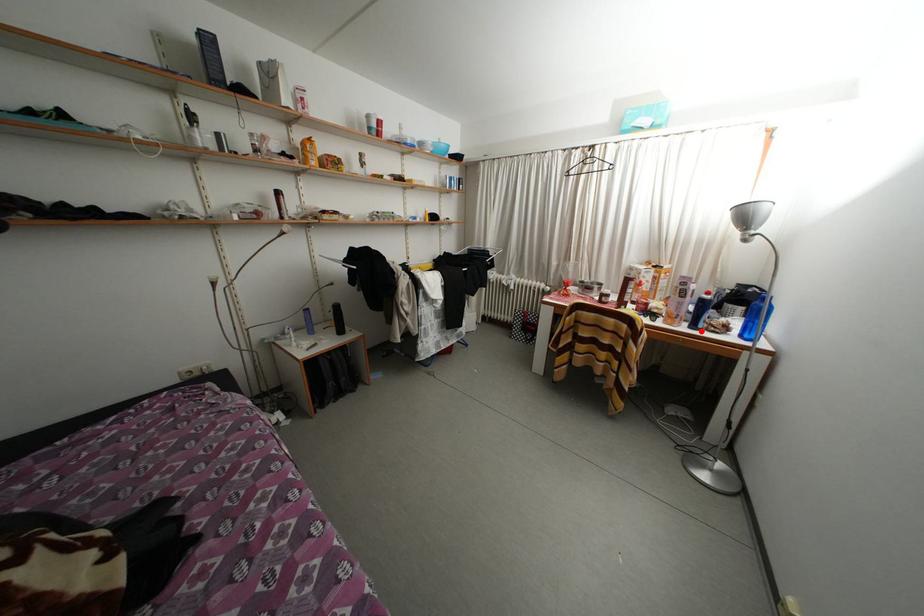
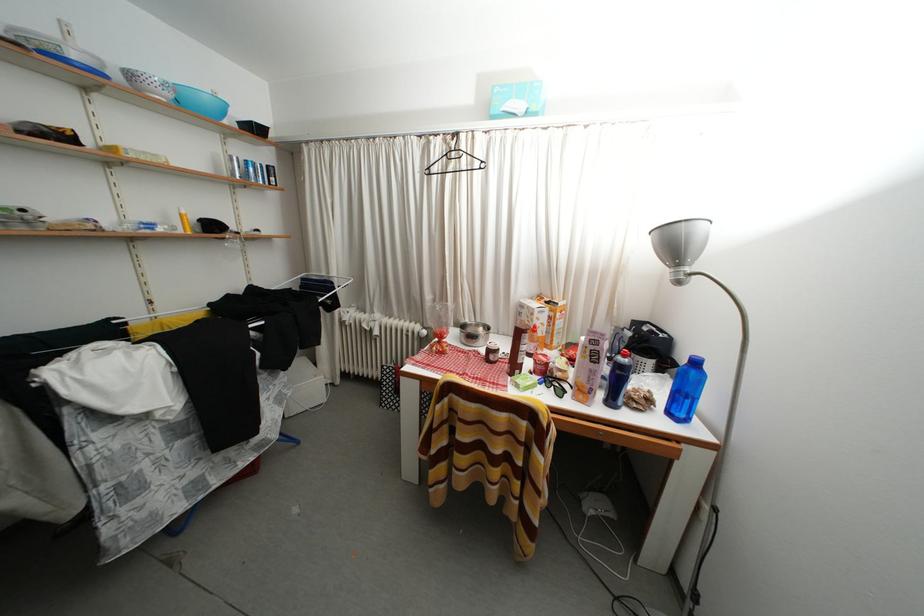
Locate, in the second image, the point that corresponds to the highlighted location in the first image.

(618, 408)